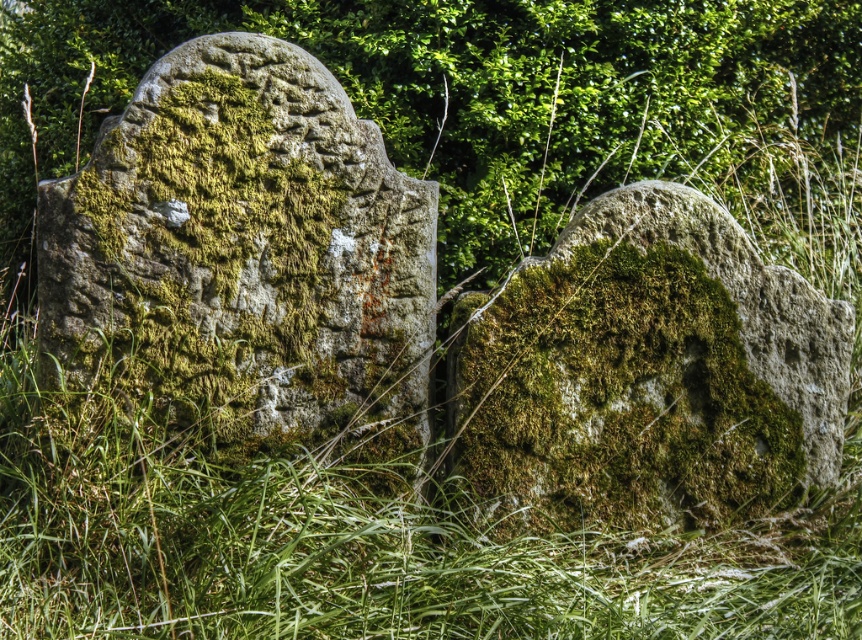
Which of these two, green mossy stone at upper center or green mossy stone at left, stands shorter?

Standing shorter between the two is green mossy stone at upper center.

Which is below, green mossy stone at upper center or green mossy stone at left?

green mossy stone at left is below.

Measure the distance between point [731,145] and camera.

Point [731,145] is 4.09 meters from camera.

Image resolution: width=862 pixels, height=640 pixels. In order to click on green mossy stone at upper center in this screenshot , I will do `click(507, 106)`.

In the scene shown: Is green mossy stone at upper center bigger than green mossy stone at center?

Yes, green mossy stone at upper center is bigger than green mossy stone at center.

Can you confirm if green mossy stone at upper center is positioned below green mossy stone at center?

Incorrect, green mossy stone at upper center is not positioned below green mossy stone at center.

Is point (323, 4) closer to camera compared to point (836, 413)?

No, (323, 4) is further to viewer.

Locate an element on the screen. The width and height of the screenshot is (862, 640). green mossy stone at upper center is located at coordinates (507, 106).

You are a GUI agent. You are given a task and a screenshot of the screen. Output one action in this format:
    pyautogui.click(x=<x>, y=<y>)
    Task: Click on the green mossy stone at left
    
    Given the screenshot: What is the action you would take?
    pyautogui.click(x=245, y=257)

Is point (186, 74) less distant than point (481, 365)?

Yes, point (186, 74) is in front of point (481, 365).

Measure the distance between point (364, 404) and camera.

Point (364, 404) and camera are 10.63 feet apart from each other.

Locate an element on the screen. This screenshot has height=640, width=862. green mossy stone at left is located at coordinates (245, 257).